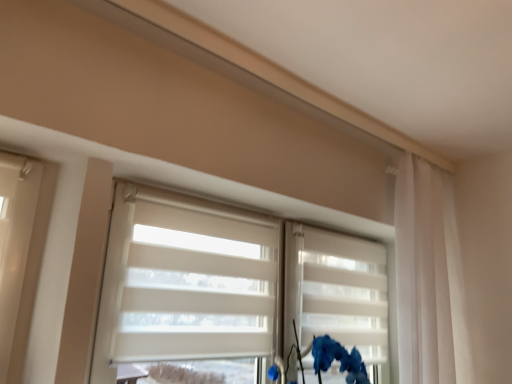
Question: Considering the positions of matte blue flower at lower right and white matte blinds at center in the image, is matte blue flower at lower right bigger or smaller than white matte blinds at center?

Choices:
 (A) small
 (B) big

Answer: (A)

Question: From their relative heights in the image, would you say matte blue flower at lower right is taller or shorter than white matte blinds at center?

Choices:
 (A) tall
 (B) short

Answer: (B)

Question: Which object is the farthest from the matte blue flower at lower right?

Choices:
 (A) white sheer curtain at right
 (B) white matte blinds at center
 (C) white matte shutter at center

Answer: (A)

Question: Which object is positioned farthest from the white sheer curtain at right?

Choices:
 (A) white matte shutter at center
 (B) matte blue flower at lower right
 (C) white matte blinds at center

Answer: (C)